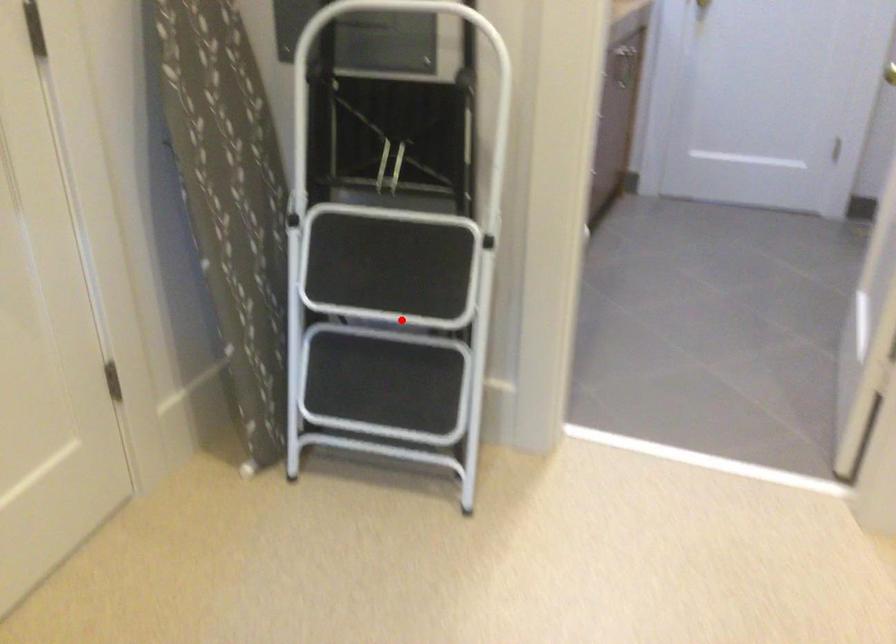
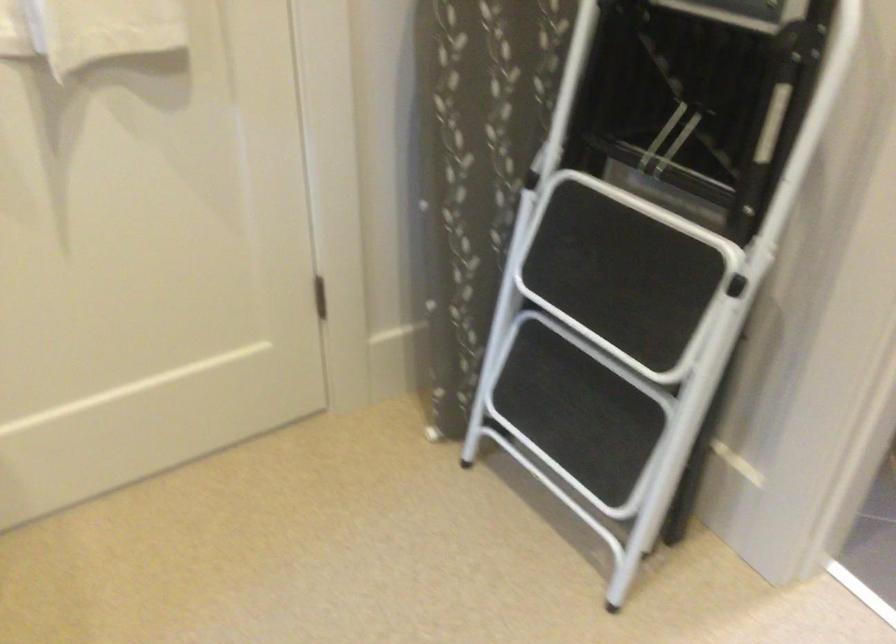
Question: I am providing you with two images of the same scene from different viewpoints. Given a red point in image1, look at the same physical point in image2. Is it:

Choices:
 (A) Closer to the viewpoint
 (B) Farther from the viewpoint

Answer: (A)